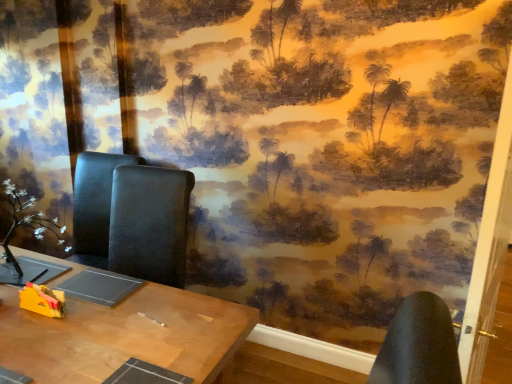
Question: Is white matte flower at left outside wooden table at center?

Choices:
 (A) no
 (B) yes

Answer: (B)

Question: Is white matte flower at left in contact with wooden table at center?

Choices:
 (A) yes
 (B) no

Answer: (B)

Question: Considering the relative sizes of white matte flower at left and wooden table at center in the image provided, is white matte flower at left taller than wooden table at center?

Choices:
 (A) no
 (B) yes

Answer: (A)

Question: Does white matte flower at left have a lesser width compared to wooden table at center?

Choices:
 (A) yes
 (B) no

Answer: (A)

Question: From the image's perspective, does white matte flower at left appear higher than wooden table at center?

Choices:
 (A) yes
 (B) no

Answer: (A)

Question: Considering the relative positions of wooden table at center and yellow plastic toy at lower left in the image provided, is wooden table at center to the left or to the right of yellow plastic toy at lower left?

Choices:
 (A) left
 (B) right

Answer: (A)

Question: From the image's perspective, is wooden table at center located above or below yellow plastic toy at lower left?

Choices:
 (A) above
 (B) below

Answer: (B)

Question: Is wooden table at center wider or thinner than yellow plastic toy at lower left?

Choices:
 (A) wide
 (B) thin

Answer: (A)

Question: Considering their positions, is wooden table at center located in front of or behind yellow plastic toy at lower left?

Choices:
 (A) behind
 (B) front

Answer: (B)

Question: Considering the positions of point (19, 289) and point (120, 309), is point (19, 289) closer or farther from the camera than point (120, 309)?

Choices:
 (A) closer
 (B) farther

Answer: (B)

Question: From the image's perspective, is yellow plastic toy at lower left located above or below wooden table at center?

Choices:
 (A) above
 (B) below

Answer: (A)

Question: Is yellow plastic toy at lower left taller or shorter than wooden table at center?

Choices:
 (A) tall
 (B) short

Answer: (B)

Question: In terms of width, does yellow plastic toy at lower left look wider or thinner when compared to wooden table at center?

Choices:
 (A) wide
 (B) thin

Answer: (B)

Question: Based on their sizes in the image, would you say yellow plastic toy at lower left is bigger or smaller than white matte flower at left?

Choices:
 (A) big
 (B) small

Answer: (B)

Question: From their relative heights in the image, would you say yellow plastic toy at lower left is taller or shorter than white matte flower at left?

Choices:
 (A) tall
 (B) short

Answer: (B)